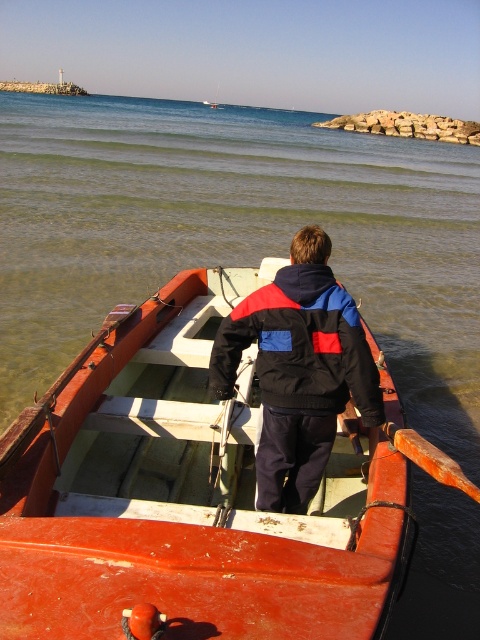
Question: Among these objects, which one is nearest to the camera?

Choices:
 (A) smooth wood boat at center
 (B) black nylon jacket at center

Answer: (A)

Question: Is smooth wood boat at center further to camera compared to black nylon jacket at center?

Choices:
 (A) yes
 (B) no

Answer: (B)

Question: Does smooth wood boat at center appear on the right side of black nylon jacket at center?

Choices:
 (A) yes
 (B) no

Answer: (B)

Question: Can you confirm if smooth wood boat at center is thinner than black nylon jacket at center?

Choices:
 (A) no
 (B) yes

Answer: (A)